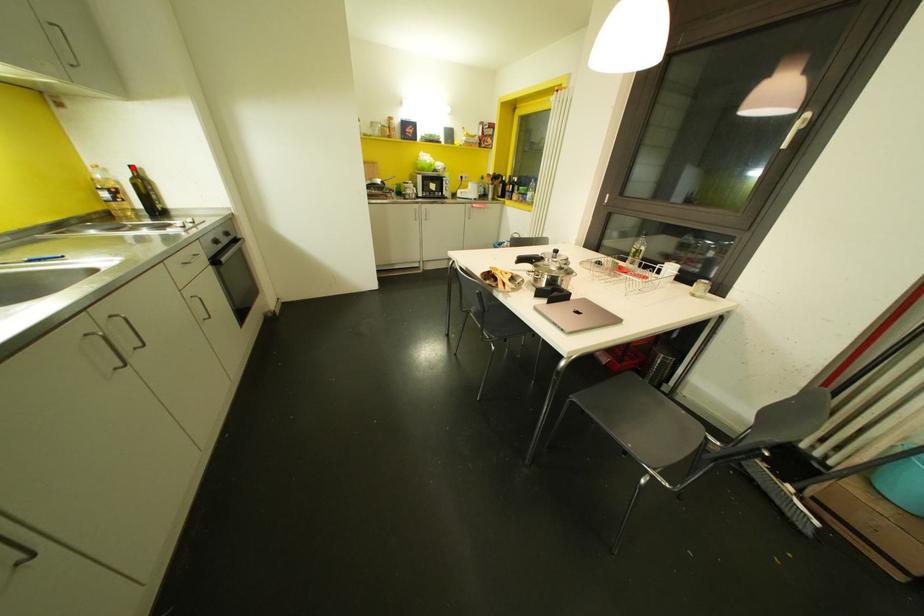
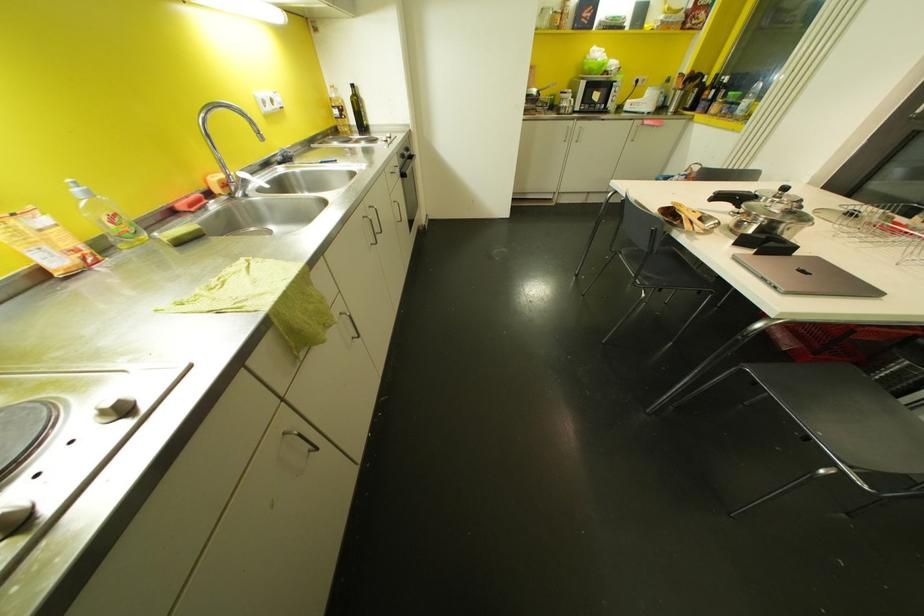
Where in the second image is the point corresponding to the highlighted location from the first image?

(353, 84)